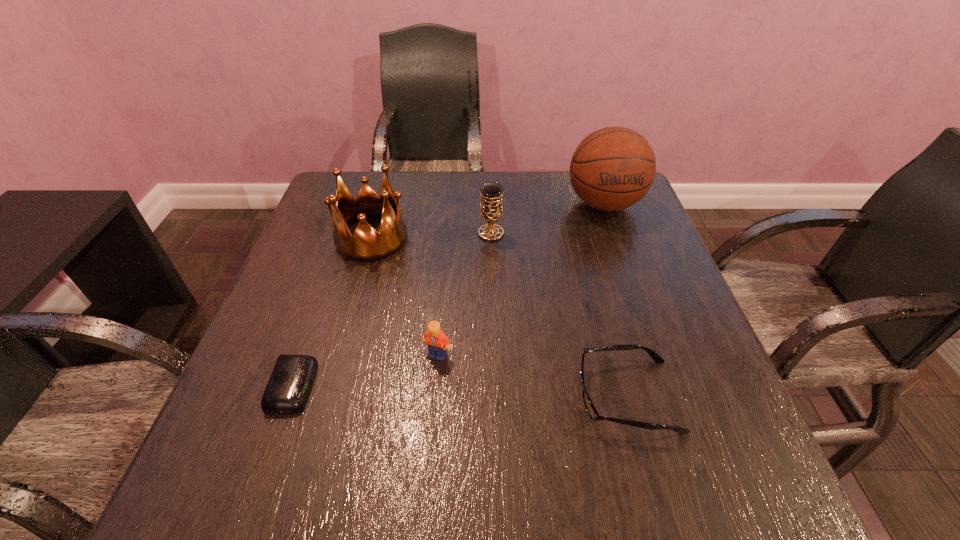
At what (x,y) coordinates should I click in order to perform the action: click on vacant space located 0.310m on the front of the third object from right to left. Please return your answer as a coordinate pair (x, y). Looking at the image, I should click on (493, 345).

Identify the location of free space located 0.120m on the front-facing side of the fourth tallest object. The width and height of the screenshot is (960, 540). (432, 422).

At what (x,y) coordinates should I click in order to perform the action: click on vacant space located on the front-facing side of the spectacles. Please return your answer as a coordinate pair (x, y). Image resolution: width=960 pixels, height=540 pixels. Looking at the image, I should click on (382, 396).

This screenshot has width=960, height=540. I want to click on vacant space situated on the front-facing side of the spectacles, so click(x=388, y=396).

Find the location of `free space located 0.160m on the front-facing side of the spectacles`. free space located 0.160m on the front-facing side of the spectacles is located at coordinates (486, 396).

Where is `free point located 0.300m on the display of the alarm clock`? The height and width of the screenshot is (540, 960). free point located 0.300m on the display of the alarm clock is located at coordinates (483, 386).

Where is `basketball that is at the far edge`? This screenshot has height=540, width=960. basketball that is at the far edge is located at coordinates (613, 168).

At what (x,y) coordinates should I click in order to perform the action: click on crown that is at the far edge. Please return your answer as a coordinate pair (x, y). Looking at the image, I should click on (366, 245).

Where is `crown positioned at the left edge`? Image resolution: width=960 pixels, height=540 pixels. crown positioned at the left edge is located at coordinates point(366,245).

Locate an element on the screen. The height and width of the screenshot is (540, 960). alarm clock present at the left edge is located at coordinates (288, 388).